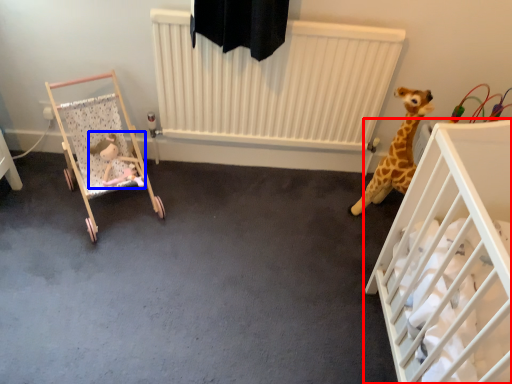
Question: Which object is further to the camera taking this photo, infant bed (highlighted by a red box) or toy (highlighted by a blue box)?

Choices:
 (A) infant bed
 (B) toy

Answer: (B)